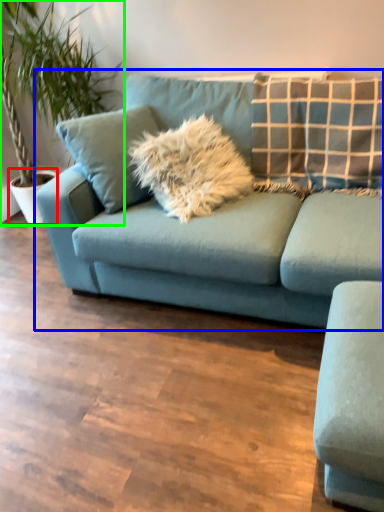
Question: Which object is the farthest from flowerpot (highlighted by a red box)? Choose among these: studio couch (highlighted by a blue box) or houseplant (highlighted by a green box).

Choices:
 (A) studio couch
 (B) houseplant

Answer: (A)